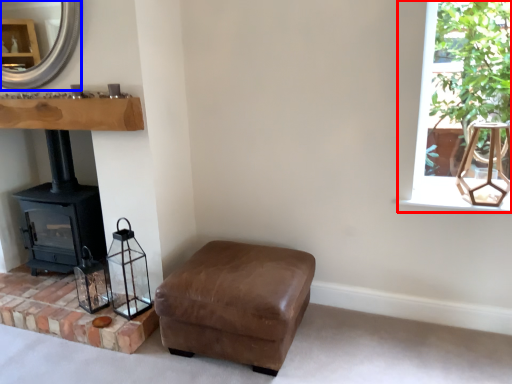
Question: Among these objects, which one is farthest to the camera, window (highlighted by a red box) or fireplace (highlighted by a blue box)?

Choices:
 (A) window
 (B) fireplace

Answer: (B)